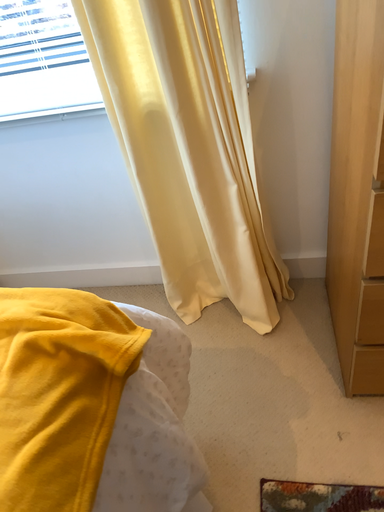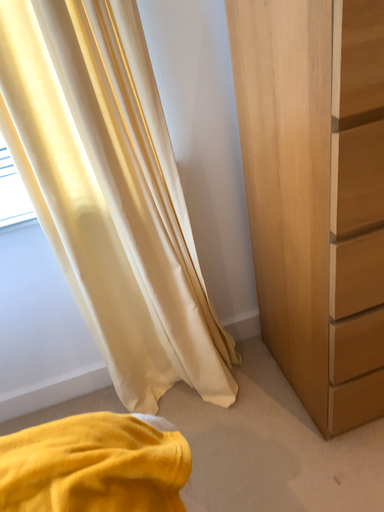
Question: How did the camera likely rotate when shooting the video?

Choices:
 (A) rotated upward
 (B) rotated downward

Answer: (A)